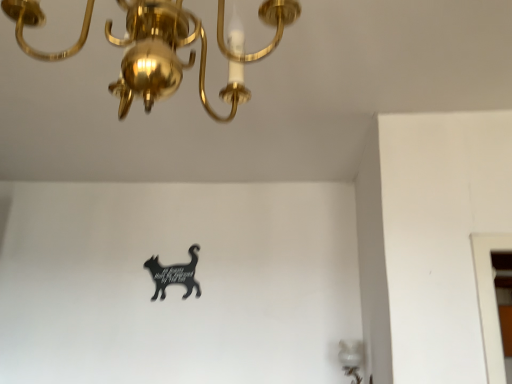
Question: Would you consider black acrylic cat at center to be distant from gold polished chandelier at upper left?

Choices:
 (A) no
 (B) yes

Answer: (B)

Question: Does black acrylic cat at center have a lesser width compared to gold polished chandelier at upper left?

Choices:
 (A) no
 (B) yes

Answer: (B)

Question: Does black acrylic cat at center have a smaller size compared to gold polished chandelier at upper left?

Choices:
 (A) no
 (B) yes

Answer: (B)

Question: Considering the relative positions of black acrylic cat at center and gold polished chandelier at upper left in the image provided, is black acrylic cat at center to the right of gold polished chandelier at upper left from the viewer's perspective?

Choices:
 (A) yes
 (B) no

Answer: (B)

Question: Is black acrylic cat at center facing away from gold polished chandelier at upper left?

Choices:
 (A) no
 (B) yes

Answer: (A)

Question: From a real-world perspective, is black acrylic cat at center located beneath gold polished chandelier at upper left?

Choices:
 (A) no
 (B) yes

Answer: (B)

Question: Is gold polished chandelier at upper left positioned with its back to black acrylic cat at center?

Choices:
 (A) no
 (B) yes

Answer: (A)

Question: Is gold polished chandelier at upper left outside of black acrylic cat at center?

Choices:
 (A) no
 (B) yes

Answer: (B)

Question: Is gold polished chandelier at upper left next to black acrylic cat at center and touching it?

Choices:
 (A) no
 (B) yes

Answer: (A)

Question: From the image's perspective, would you say gold polished chandelier at upper left is shown under black acrylic cat at center?

Choices:
 (A) no
 (B) yes

Answer: (A)

Question: Is gold polished chandelier at upper left shorter than black acrylic cat at center?

Choices:
 (A) yes
 (B) no

Answer: (B)

Question: Can black acrylic cat at center be found inside gold polished chandelier at upper left?

Choices:
 (A) no
 (B) yes

Answer: (A)

Question: Considering the positions of point (197, 284) and point (203, 96), is point (197, 284) closer or farther from the camera than point (203, 96)?

Choices:
 (A) farther
 (B) closer

Answer: (A)